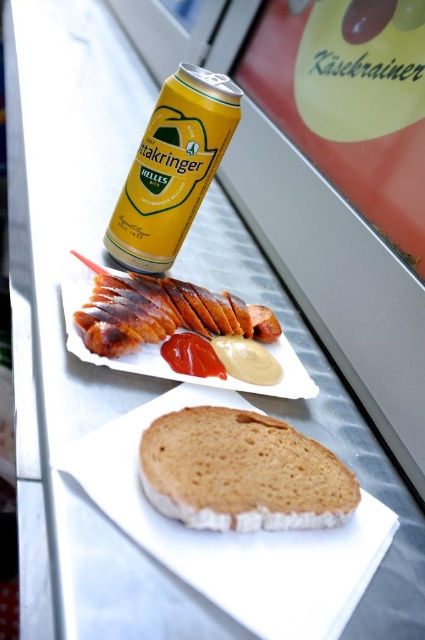
Which is more to the right, brown matte bread at center or yellow matte can at upper center?

From the viewer's perspective, brown matte bread at center appears more on the right side.

Is point (302, 486) more distant than point (115, 205)?

No.

The height and width of the screenshot is (640, 425). Find the location of `brown matte bread at center`. brown matte bread at center is located at coordinates (241, 472).

The height and width of the screenshot is (640, 425). What are the coordinates of `brown matte bread at center` in the screenshot? It's located at (241, 472).

Which of these two, yellow matte can at upper center or smokey brown sausage at center, stands taller?

Standing taller between the two is yellow matte can at upper center.

Can you confirm if yellow matte can at upper center is positioned below smokey brown sausage at center?

No.

Where is `yellow matte can at upper center`? yellow matte can at upper center is located at coordinates (172, 168).

Locate an element on the screen. Image resolution: width=425 pixels, height=640 pixels. yellow matte can at upper center is located at coordinates (172, 168).

Is brown matte bread at center wider than smokey brown sausage at center?

No, brown matte bread at center is not wider than smokey brown sausage at center.

Looking at this image, between brown matte bread at center and smokey brown sausage at center, which one appears on the left side from the viewer's perspective?

smokey brown sausage at center

Find the location of `brown matte bread at center`. brown matte bread at center is located at coordinates (241, 472).

Where is `brown matte bread at center`? Image resolution: width=425 pixels, height=640 pixels. brown matte bread at center is located at coordinates (241, 472).